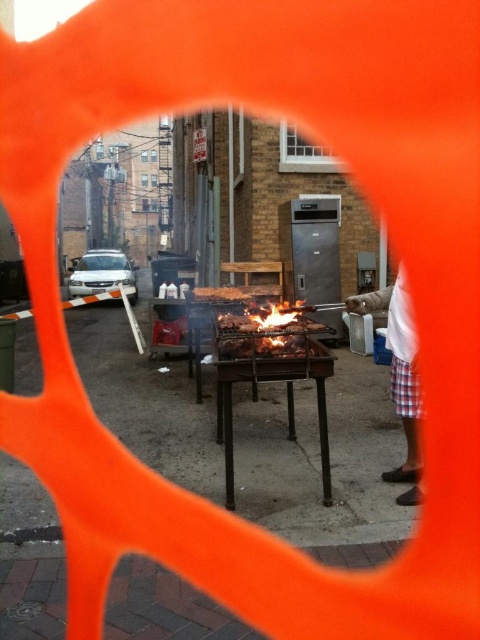
You are standing in front of the barbecue grill and want to place two markers on the concrete surface at the specified coordinates. The first marker is at point (x=280, y=339) and the second at point (x=222, y=292). Which marker will be closer to your current position?

The marker at point (x=280, y=339) will be closer to your current position because it is closer to the viewer than point (x=222, y=292).